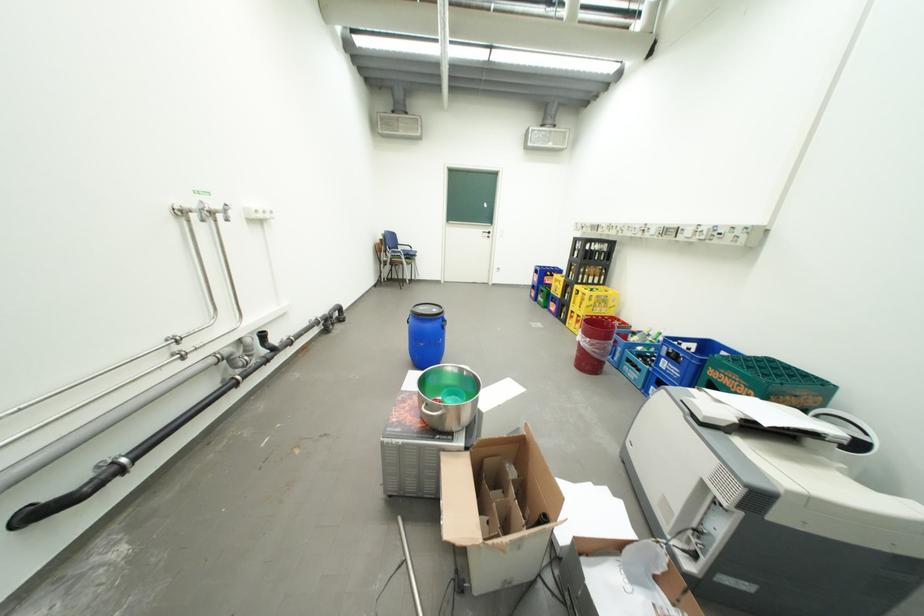
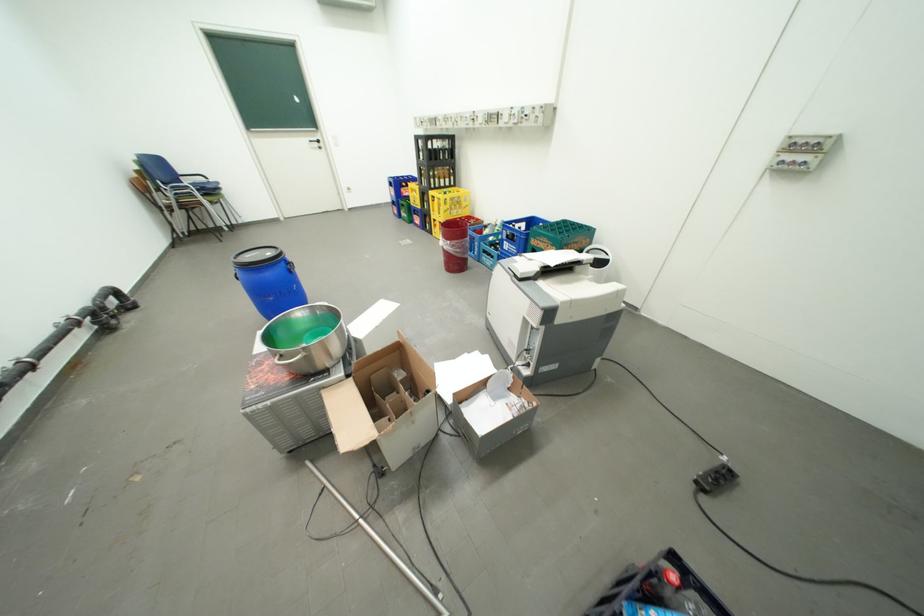
Locate, in the second image, the point that corresponds to (602,309) in the first image.

(459, 212)